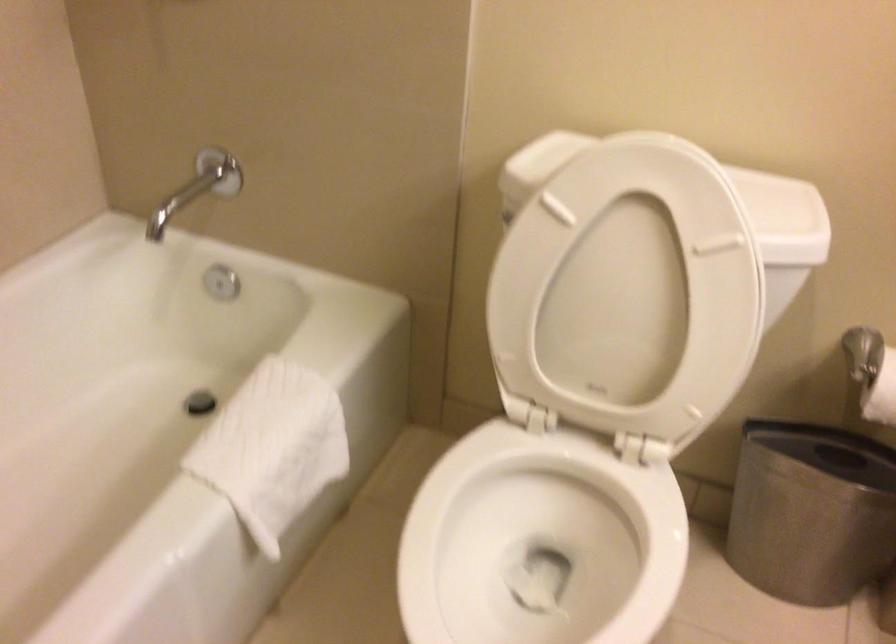
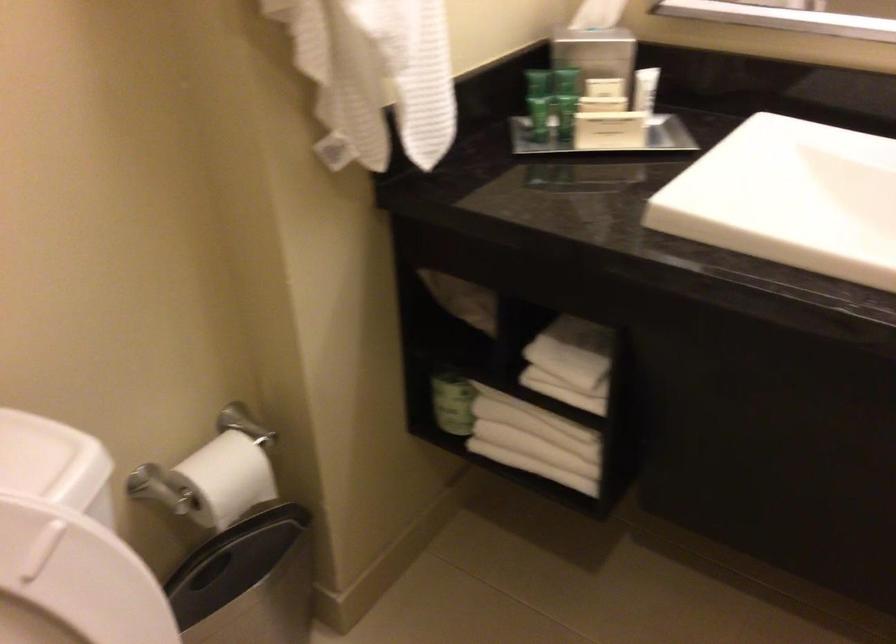
In the second image, find the point that corresponds to point (711, 269) in the first image.

(73, 582)